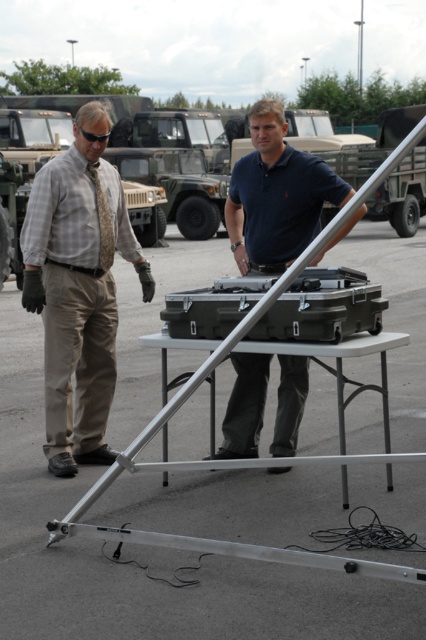
Measure the distance between point [97,218] and camera.

They are 5.79 meters apart.

Between plaid shirt at left and matte black case at center, which one appears on the right side from the viewer's perspective?

Positioned to the right is matte black case at center.

Where is `plaid shirt at left`? The height and width of the screenshot is (640, 426). plaid shirt at left is located at coordinates (78, 288).

Between dark blue polo shirt at center and matte black case at center, which one appears on the left side from the viewer's perspective?

matte black case at center

Does dark blue polo shirt at center appear on the left side of matte black case at center?

Incorrect, dark blue polo shirt at center is not on the left side of matte black case at center.

Is point (273, 170) positioned after point (221, 317)?

Yes, it is behind point (221, 317).

Locate an element on the screen. The height and width of the screenshot is (640, 426). dark blue polo shirt at center is located at coordinates (276, 195).

Is plaid shirt at left bigger than gold textured tie at left?

Correct, plaid shirt at left is larger in size than gold textured tie at left.

Does plaid shirt at left have a lesser height compared to gold textured tie at left?

Incorrect, plaid shirt at left's height does not fall short of gold textured tie at left's.

At what (x,y) coordinates should I click in order to perform the action: click on plaid shirt at left. Please return your answer as a coordinate pair (x, y). The width and height of the screenshot is (426, 640). Looking at the image, I should click on (78, 288).